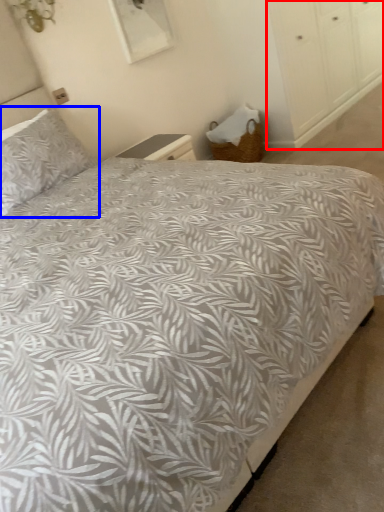
Question: Which of the following is the farthest to the observer, dresser (highlighted by a red box) or pillow (highlighted by a blue box)?

Choices:
 (A) dresser
 (B) pillow

Answer: (A)